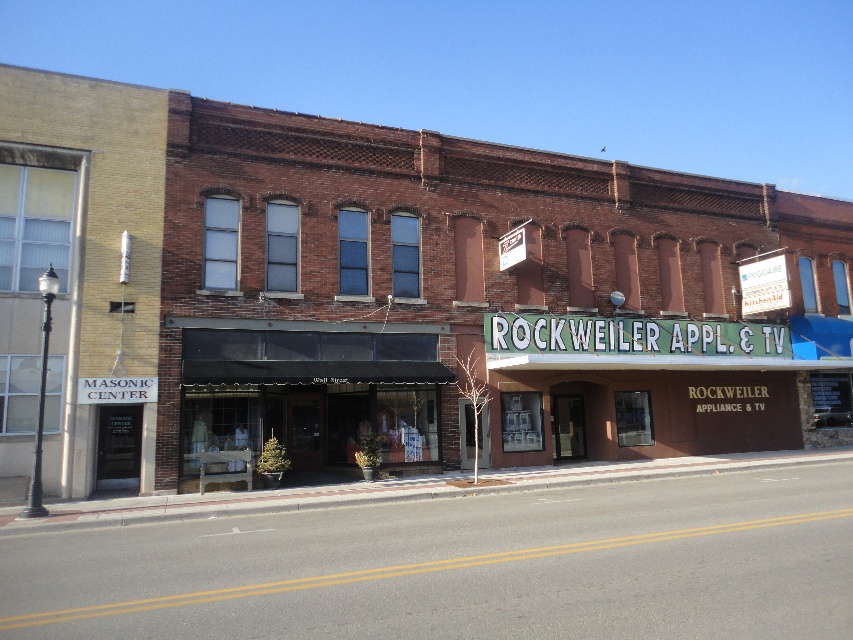
Question: Does brown brick building at center appear on the right side of matte black awning at center?

Choices:
 (A) no
 (B) yes

Answer: (B)

Question: Which object appears farthest from the camera in this image?

Choices:
 (A) matte black awning at center
 (B) brown brick building at center

Answer: (A)

Question: Observing the image, what is the correct spatial positioning of brown brick building at center in reference to matte black awning at center?

Choices:
 (A) left
 (B) right

Answer: (B)

Question: Which object is closer to the camera taking this photo?

Choices:
 (A) brown brick building at center
 (B) matte black awning at center

Answer: (A)

Question: Is brown brick building at center smaller than matte black awning at center?

Choices:
 (A) yes
 (B) no

Answer: (B)